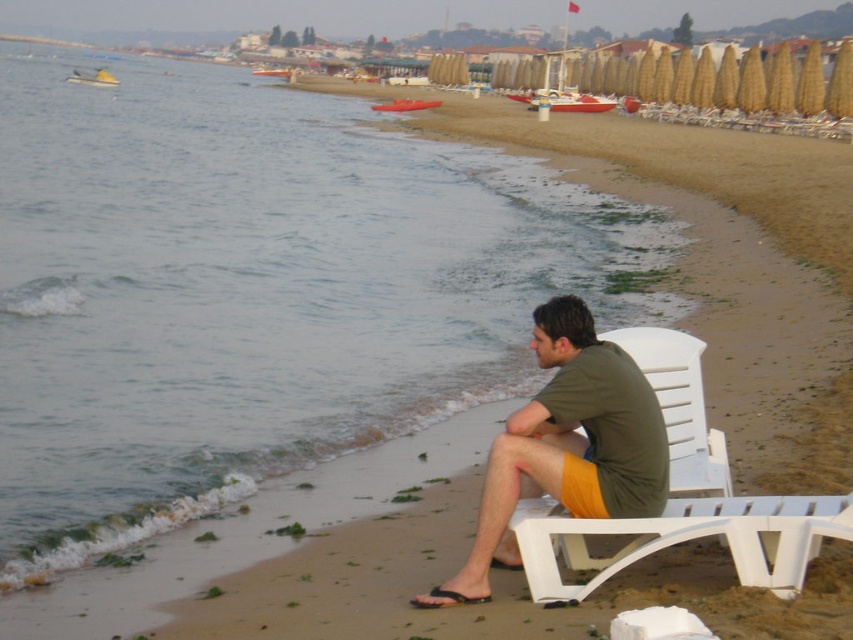
Does clear water at beach left have a lesser height compared to black rubber sandal at lower center?

In fact, clear water at beach left may be taller than black rubber sandal at lower center.

Can you confirm if clear water at beach left is positioned to the left of black rubber sandal at lower center?

Yes, clear water at beach left is to the left of black rubber sandal at lower center.

I want to click on clear water at beach left, so click(x=252, y=289).

What are the coordinates of `clear water at beach left` in the screenshot? It's located at (252, 289).

Consider the image. Between clear water at beach left and white plastic beach chair at lower right, which one appears on the right side from the viewer's perspective?

Positioned to the right is white plastic beach chair at lower right.

Identify the location of clear water at beach left. The width and height of the screenshot is (853, 640). (252, 289).

Locate an element on the screen. clear water at beach left is located at coordinates (252, 289).

Is white plastic beach chair at lower right above black rubber sandal at lower center?

Yes.

Does point (532, 509) lie behind point (480, 596)?

Yes.

Which is behind, point (566, 557) or point (453, 602)?

The point (566, 557) is behind.

I want to click on white plastic beach chair at lower right, so click(x=682, y=497).